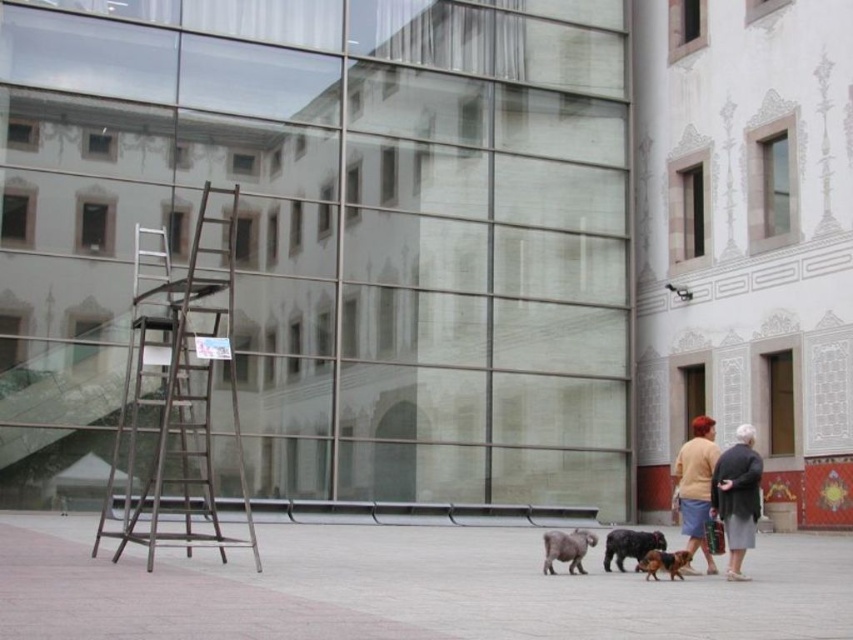
Question: From the image, what is the correct spatial relationship of matte yellow sweater at center in relation to brown fur dog at lower center?

Choices:
 (A) above
 (B) below

Answer: (A)

Question: Estimate the real-world distances between objects in this image. Which object is closer to the matte yellow sweater at center?

Choices:
 (A) brown fur dog at lower center
 (B) metallic ladder at left
 (C) gray wool coat at lower right

Answer: (A)

Question: Does fluffy gray dog at lower center come behind shiny black dog at center?

Choices:
 (A) yes
 (B) no

Answer: (B)

Question: Which object appears farthest from the camera in this image?

Choices:
 (A) pavement at lower center
 (B) metallic ladder at left

Answer: (B)

Question: Is pavement at lower center below shiny black dog at center?

Choices:
 (A) yes
 (B) no

Answer: (B)

Question: Which is farther from the shiny black dog at center?

Choices:
 (A) gray wool coat at lower right
 (B) pavement at lower center
 (C) fluffy gray dog at lower center

Answer: (B)